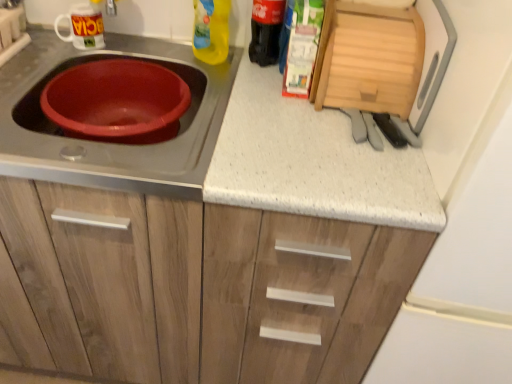
Find the location of a particular element. vacant region to the left of yellow plastic bottle at upper center, the 1th bottle viewed from the left is located at coordinates (145, 57).